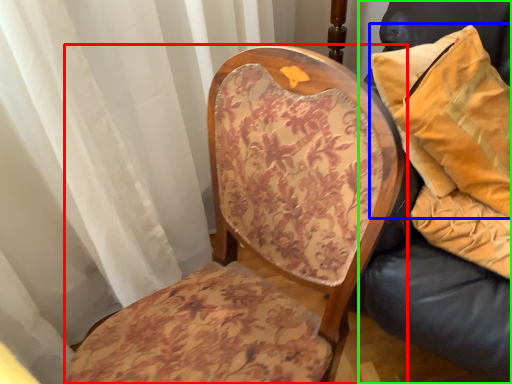
Question: Considering the real-world distances, which object is closest to chair (highlighted by a red box)? pillow (highlighted by a blue box) or furniture (highlighted by a green box).

Choices:
 (A) pillow
 (B) furniture

Answer: (B)